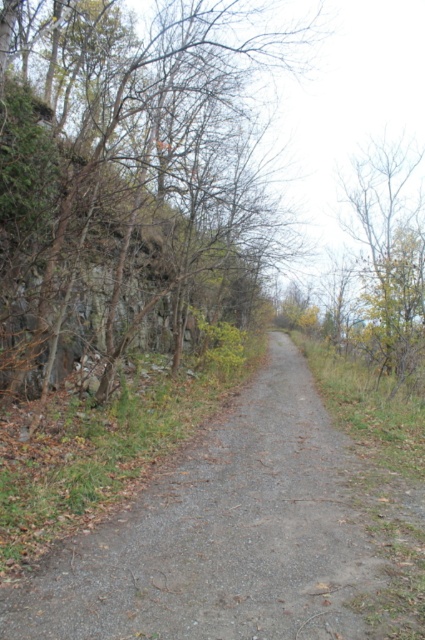
In the scene shown: Between brown bark tree at center and gray gravel path at center, which one is positioned higher?

Positioned higher is brown bark tree at center.

Locate an element on the screen. brown bark tree at center is located at coordinates (129, 177).